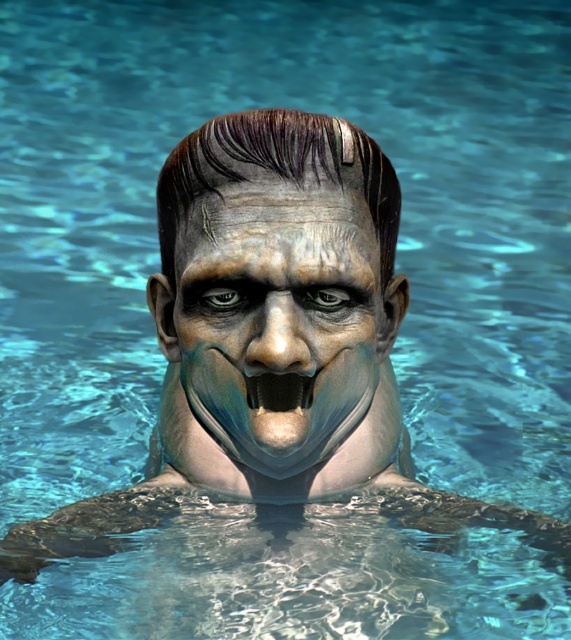
Question: Is pale matte face at center above black matte teeth at center?

Choices:
 (A) yes
 (B) no

Answer: (A)

Question: Can you confirm if pale matte face at center is positioned to the right of black matte teeth at center?

Choices:
 (A) no
 (B) yes

Answer: (A)

Question: Which object appears closest to the camera in this image?

Choices:
 (A) pale matte face at center
 (B) black matte teeth at center

Answer: (A)

Question: Can you confirm if pale matte face at center is positioned to the right of black matte teeth at center?

Choices:
 (A) no
 (B) yes

Answer: (A)

Question: Among these points, which one is nearest to the camera?

Choices:
 (A) (x=297, y=372)
 (B) (x=262, y=412)

Answer: (A)